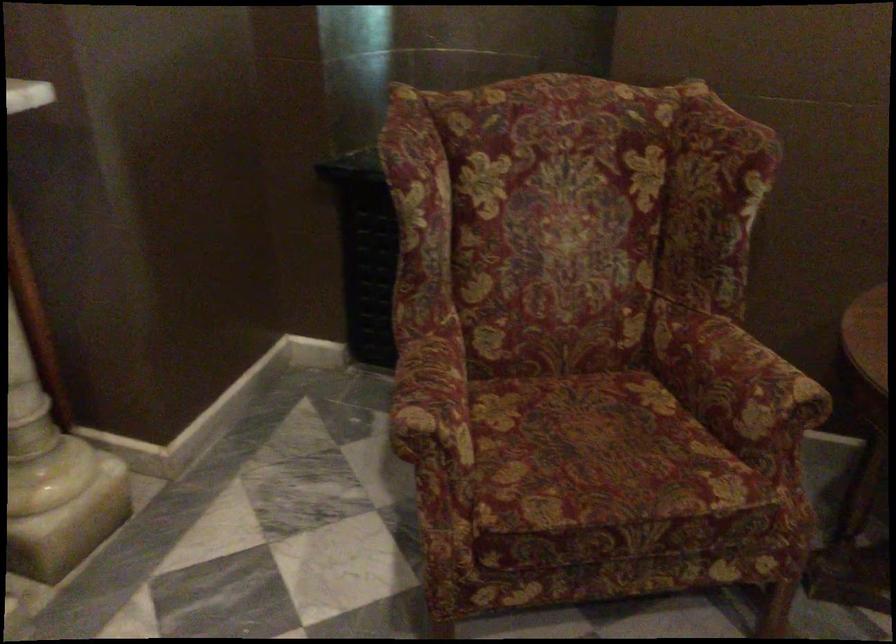
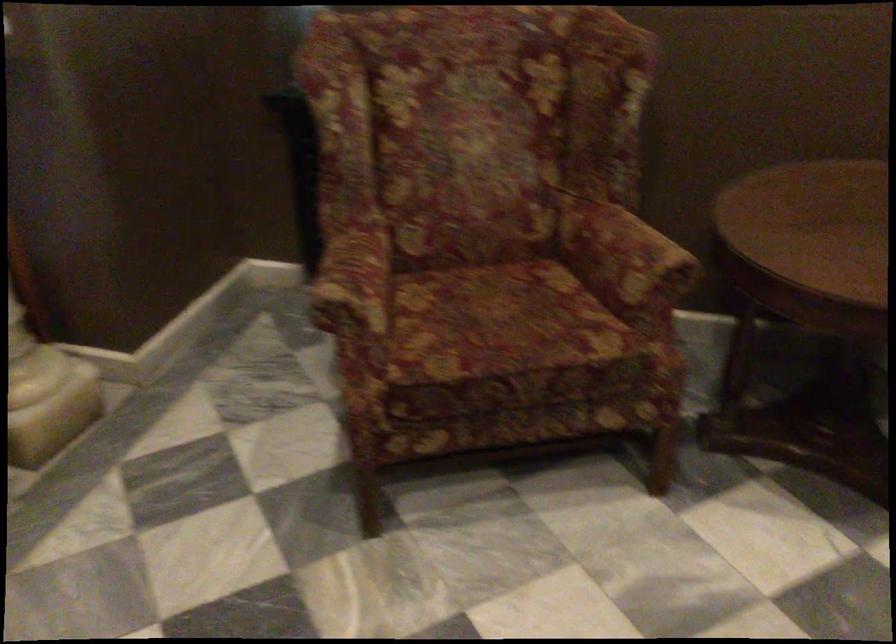
Locate, in the second image, the point that corresponds to point 738,384 in the first image.

(624, 258)